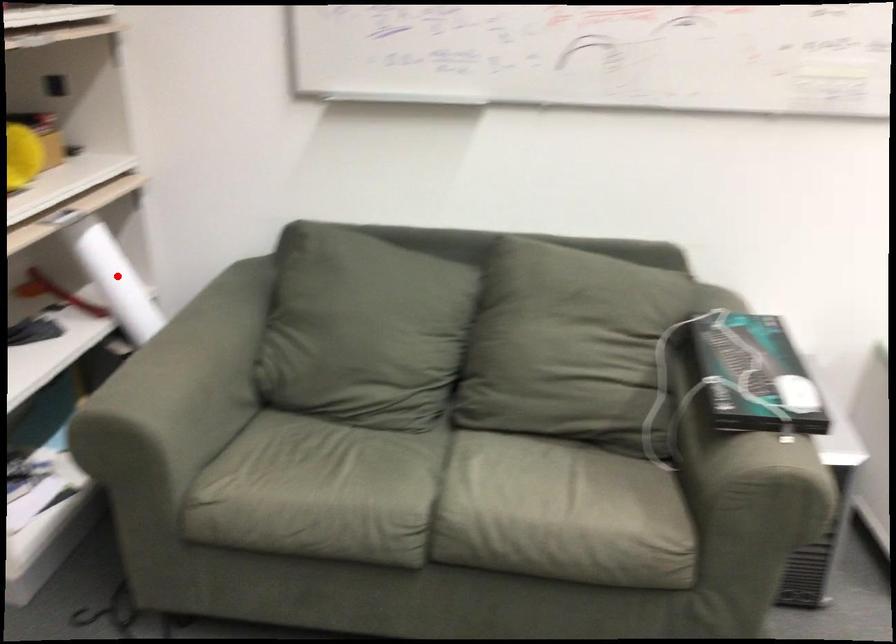
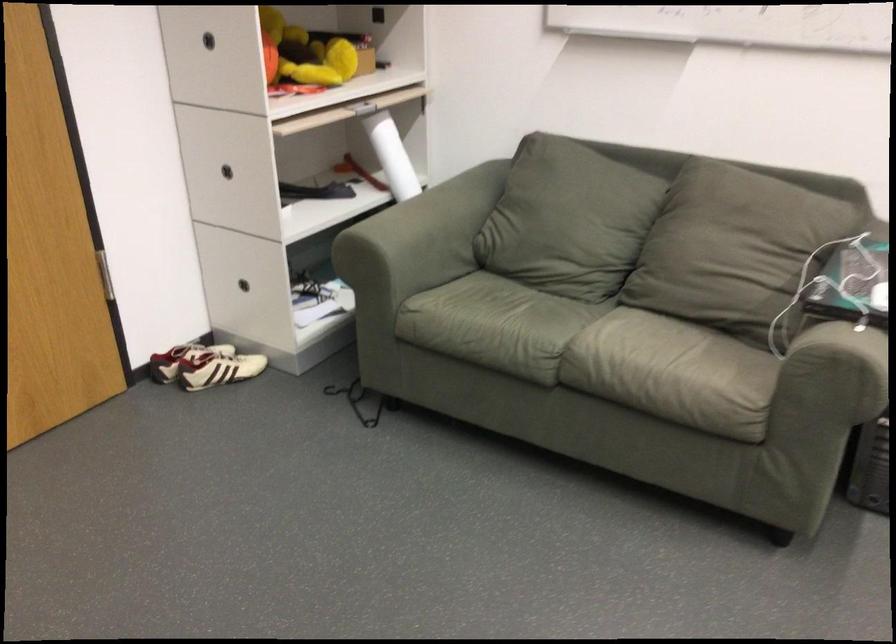
Locate, in the second image, the point that corresponds to the highlighted location in the first image.

(392, 156)